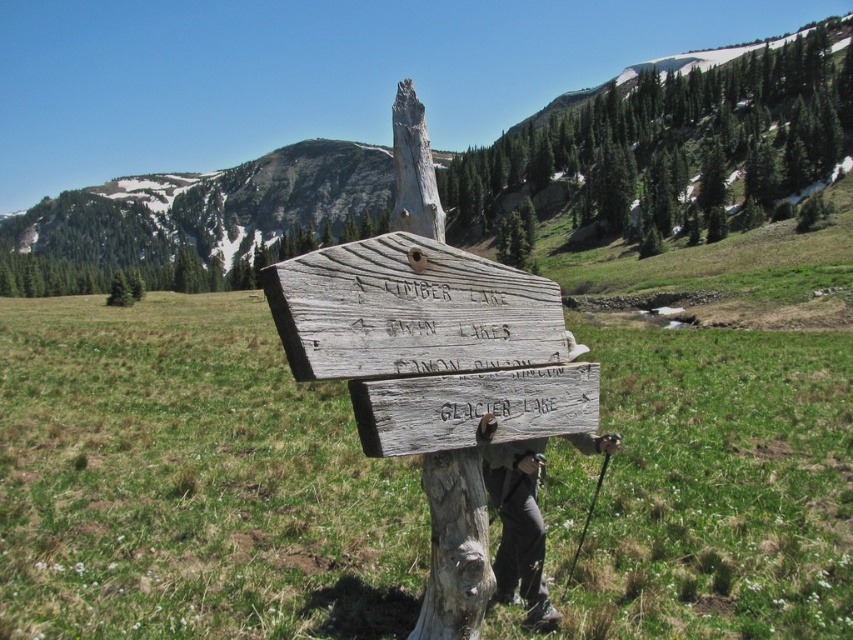
You are a hiker planning to take a photo of the gray wood signpost at center and the green textured tree at upper center. Which object should you focus on first if you want both to be in sharp focus, considering their positions relative to you?

→ The gray wood signpost at center is closer to you than the green textured tree at upper center. To have both in sharp focus, focus on the gray wood signpost at center first since it is nearer, ensuring the tree in the background remains in focus as well.